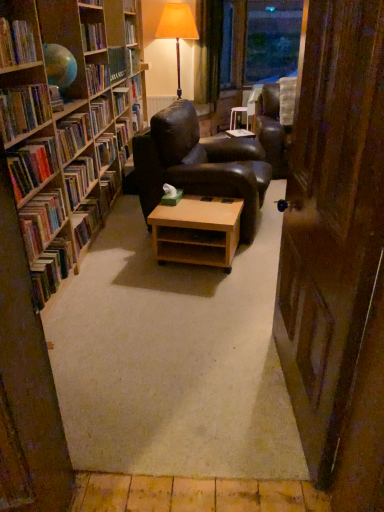
Question: Should I look upward or downward to see light brown wooden table at center?

Choices:
 (A) up
 (B) down

Answer: (A)

Question: Can you confirm if hardcover book at left, the eighth book viewed from the top, is positioned to the left of wooden side table at center?

Choices:
 (A) yes
 (B) no

Answer: (A)

Question: Is hardcover book at left, the eighth book viewed from the top, looking in the opposite direction of wooden side table at center?

Choices:
 (A) no
 (B) yes

Answer: (A)

Question: Is hardcover book at left, the eighth book viewed from the top, not near wooden side table at center?

Choices:
 (A) no
 (B) yes

Answer: (B)

Question: From a real-world perspective, is hardcover book at left, the second book when ordered from bottom to top, beneath wooden side table at center?

Choices:
 (A) yes
 (B) no

Answer: (B)

Question: Can you confirm if hardcover book at left, the eighth book viewed from the top, is bigger than wooden side table at center?

Choices:
 (A) yes
 (B) no

Answer: (A)

Question: Does hardcover book at left, the eighth book viewed from the top, come behind wooden side table at center?

Choices:
 (A) yes
 (B) no

Answer: (B)

Question: Could light brown wooden table at center be considered to be inside hardcover book at left, which is the seventh book in top-to-bottom order?

Choices:
 (A) yes
 (B) no

Answer: (B)

Question: Can you confirm if hardcover book at left, which is the seventh book in top-to-bottom order, is wider than light brown wooden table at center?

Choices:
 (A) yes
 (B) no

Answer: (B)

Question: Can you confirm if hardcover book at left, which is the 3th book in bottom-to-top order, is smaller than light brown wooden table at center?

Choices:
 (A) no
 (B) yes

Answer: (B)

Question: From the image's perspective, does hardcover book at left, which is the 3th book in bottom-to-top order, appear higher than light brown wooden table at center?

Choices:
 (A) yes
 (B) no

Answer: (A)

Question: Is hardcover book at left, which is the 3th book in bottom-to-top order, positioned beyond the bounds of light brown wooden table at center?

Choices:
 (A) no
 (B) yes

Answer: (B)

Question: Can you confirm if hardcover book at left, which is the seventh book in top-to-bottom order, is positioned to the right of light brown wooden table at center?

Choices:
 (A) no
 (B) yes

Answer: (A)

Question: Is hardcover book at left, marked as the 2th book in a top-to-bottom arrangement, surrounded by hardcover book at left, the second book when ordered from bottom to top?

Choices:
 (A) yes
 (B) no

Answer: (B)